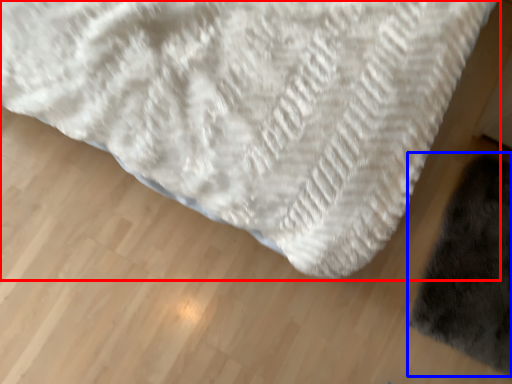
Question: Which of the following is the closest to the observer, towel (highlighted by a red box) or mat (highlighted by a blue box)?

Choices:
 (A) towel
 (B) mat

Answer: (A)